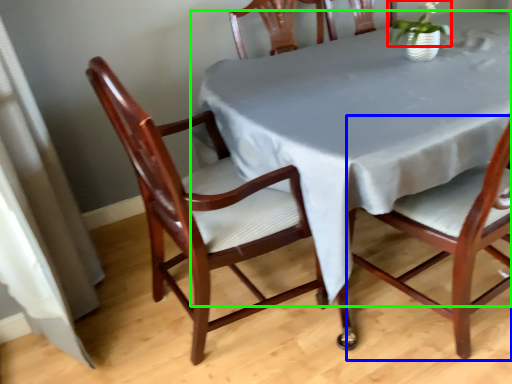
Question: Estimate the real-world distances between objects in this image. Which object is closer to plant (highlighted by a red box), chair (highlighted by a blue box) or table (highlighted by a green box)?

Choices:
 (A) chair
 (B) table

Answer: (B)